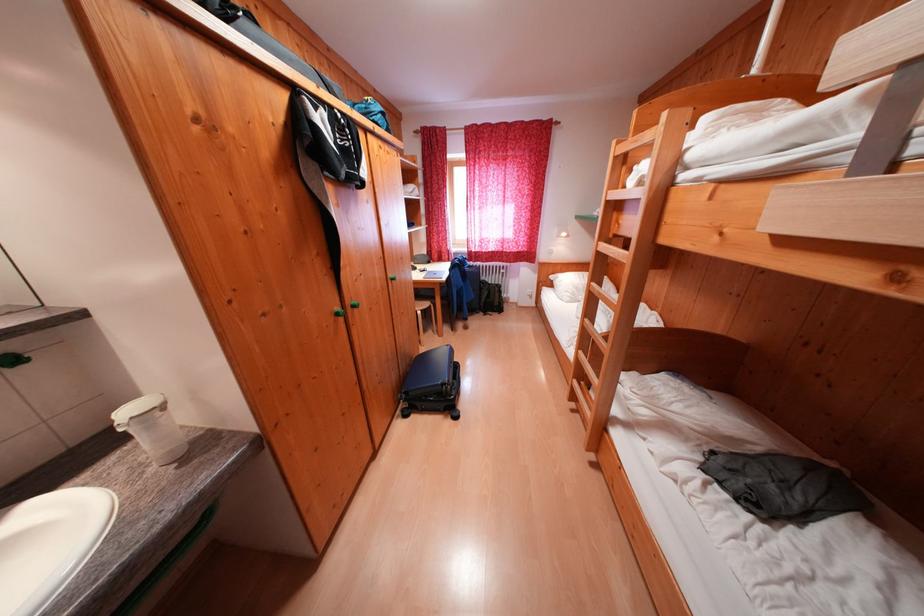
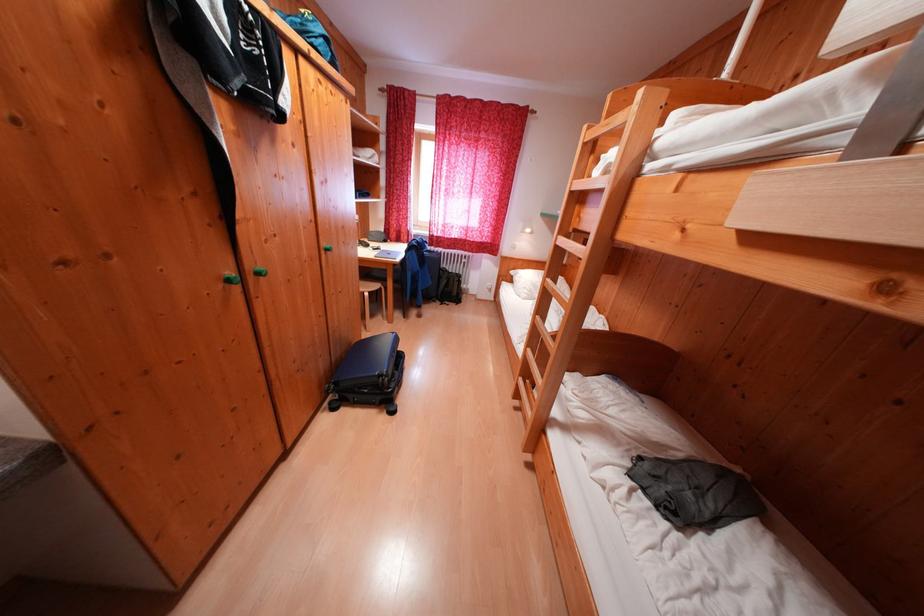
Find the pixel in the second image that matches the point at 589,355 in the first image.

(537, 354)